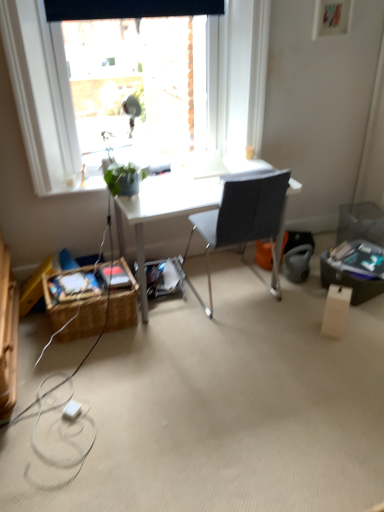
Question: Is white plastic power outlet at lower left facing away from woven brown picnic basket at lower left?

Choices:
 (A) yes
 (B) no

Answer: (B)

Question: Is white plastic power outlet at lower left behind woven brown picnic basket at lower left?

Choices:
 (A) no
 (B) yes

Answer: (A)

Question: Does white plastic power outlet at lower left come in front of woven brown picnic basket at lower left?

Choices:
 (A) yes
 (B) no

Answer: (A)

Question: Can you confirm if white plastic power outlet at lower left is bigger than woven brown picnic basket at lower left?

Choices:
 (A) no
 (B) yes

Answer: (A)

Question: Is white plastic power outlet at lower left taller than woven brown picnic basket at lower left?

Choices:
 (A) no
 (B) yes

Answer: (A)

Question: From a real-world perspective, is woven brown picnic basket at lower left positioned above or below transparent glass window at upper center?

Choices:
 (A) below
 (B) above

Answer: (A)

Question: Would you say woven brown picnic basket at lower left is inside or outside transparent glass window at upper center?

Choices:
 (A) outside
 (B) inside

Answer: (A)

Question: In the image, is woven brown picnic basket at lower left positioned in front of or behind transparent glass window at upper center?

Choices:
 (A) front
 (B) behind

Answer: (B)

Question: Considering the positions of woven brown picnic basket at lower left and transparent glass window at upper center in the image, is woven brown picnic basket at lower left taller or shorter than transparent glass window at upper center?

Choices:
 (A) short
 (B) tall

Answer: (A)

Question: From a real-world perspective, is gray fabric chair at center positioned above or below woven brown picnic basket at lower left?

Choices:
 (A) above
 (B) below

Answer: (A)

Question: Is point (241, 228) positioned closer to the camera than point (99, 300)?

Choices:
 (A) farther
 (B) closer

Answer: (B)

Question: Is gray fabric chair at center spatially inside woven brown picnic basket at lower left, or outside of it?

Choices:
 (A) inside
 (B) outside

Answer: (B)

Question: In terms of height, does gray fabric chair at center look taller or shorter compared to woven brown picnic basket at lower left?

Choices:
 (A) short
 (B) tall

Answer: (B)

Question: In the image, is gray fabric chair at center on the left side or the right side of transparent glass window at upper center?

Choices:
 (A) right
 (B) left

Answer: (A)

Question: Is gray fabric chair at center spatially inside transparent glass window at upper center, or outside of it?

Choices:
 (A) inside
 (B) outside

Answer: (B)